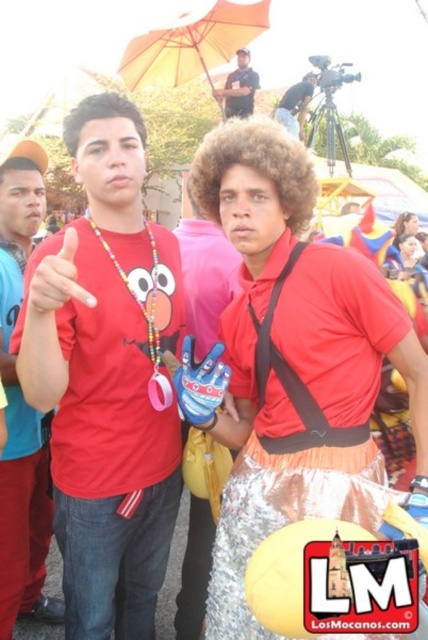
Is matte red t-shirt at left wider than shiny metallic skirt at center?

Indeed, matte red t-shirt at left has a greater width compared to shiny metallic skirt at center.

Is matte red t-shirt at left in front of shiny metallic skirt at center?

No.

Between point (130, 618) and point (354, 378), which one is positioned behind?

Point (130, 618)

Identify the location of matte red t-shirt at left. (107, 378).

Does brushed metal necklace at left have a smaller size compared to shiny metallic costume at center?

Correct, brushed metal necklace at left occupies less space than shiny metallic costume at center.

Locate an element on the screen. brushed metal necklace at left is located at coordinates (21, 406).

Is shiny metallic skirt at center smaller than shiny gold costume at center?

Yes, shiny metallic skirt at center is smaller than shiny gold costume at center.

Between shiny metallic skirt at center and shiny gold costume at center, which one appears on the right side from the viewer's perspective?

shiny gold costume at center is more to the right.

Image resolution: width=428 pixels, height=640 pixels. I want to click on shiny metallic skirt at center, so click(x=302, y=408).